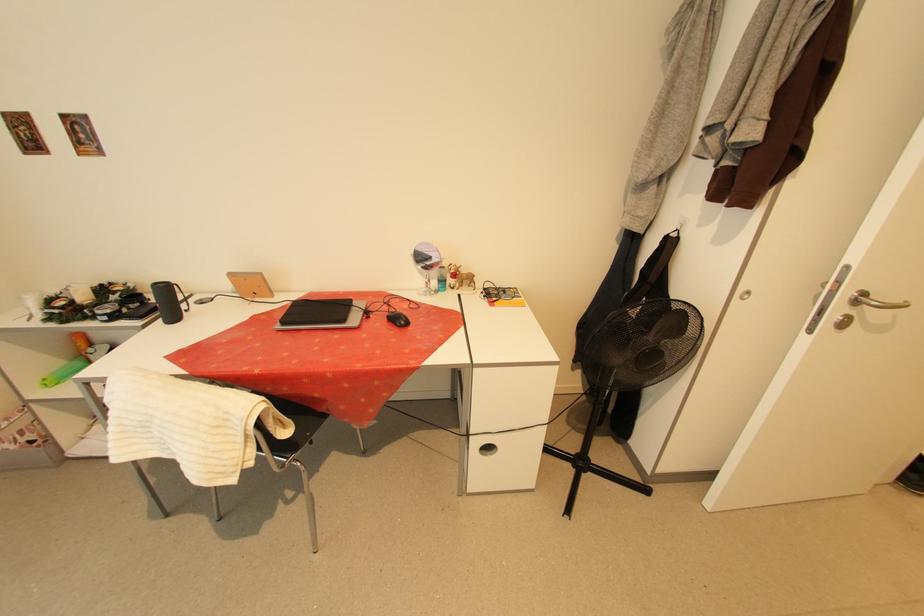
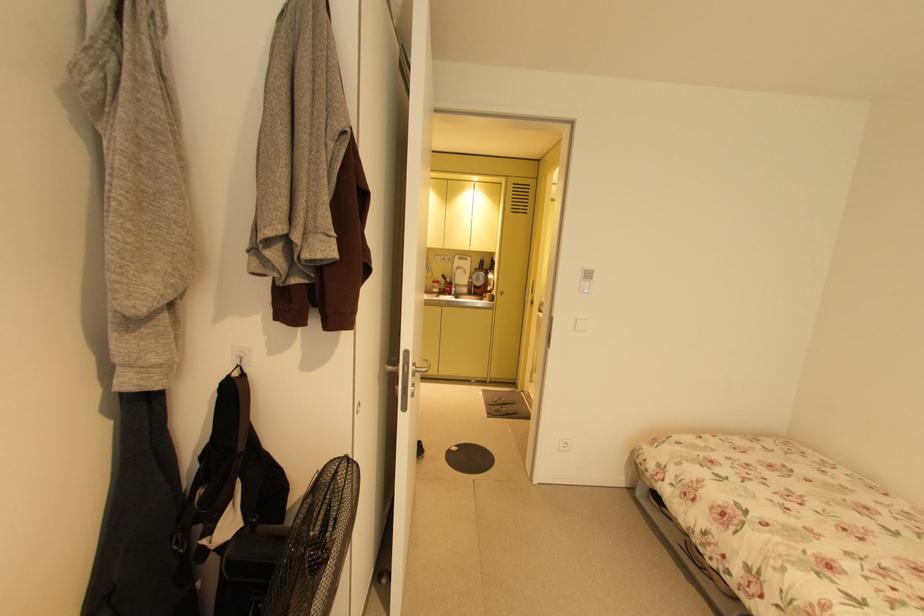
Question: The first image is from the beginning of the video and the second image is from the end. How did the camera likely rotate when shooting the video?

Choices:
 (A) Left
 (B) Right
 (C) Up
 (D) Down

Answer: (B)